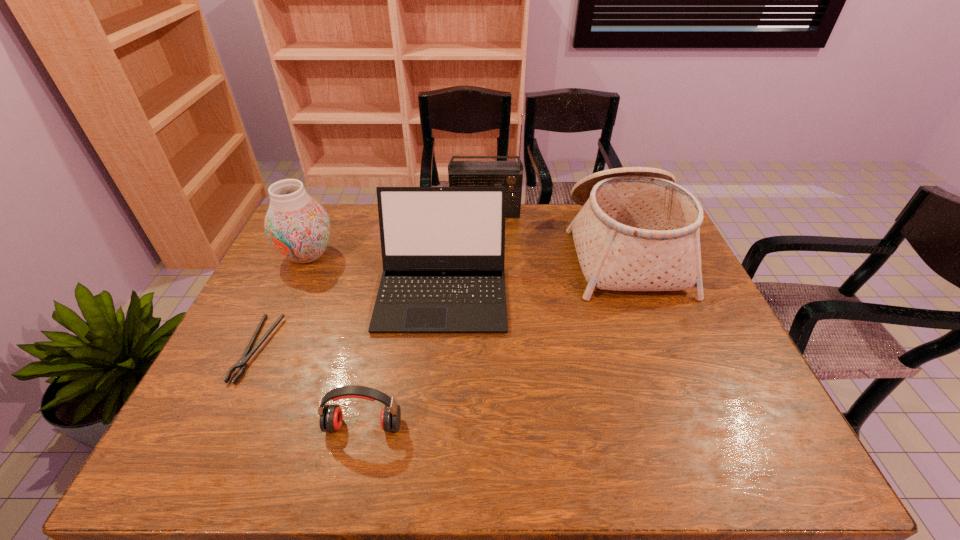
Locate an element on the screen. The height and width of the screenshot is (540, 960). tongs positioned at the left edge is located at coordinates (242, 363).

Find the location of a particular element. object that is at the right edge is located at coordinates (638, 230).

In order to click on object that is at the far left corner in this screenshot , I will do `click(298, 227)`.

Where is `object that is at the far right corner`? object that is at the far right corner is located at coordinates (638, 230).

Where is `free space at the far edge`? free space at the far edge is located at coordinates (505, 220).

Locate an element on the screen. Image resolution: width=960 pixels, height=540 pixels. vacant space at the near edge of the desktop is located at coordinates (348, 450).

The image size is (960, 540). In order to click on free space at the left edge of the desktop in this screenshot , I will do `click(296, 282)`.

In the image, there is a desktop. What are the coordinates of `vacant space at the far left corner` in the screenshot? It's located at (333, 207).

What are the coordinates of `free space between the earphone and the vase` in the screenshot? It's located at (336, 340).

You are a GUI agent. You are given a task and a screenshot of the screen. Output one action in this format:
    pyautogui.click(x=<x>, y=<y>)
    Task: Click on the unoccupied position between the vase and the second shortest object
    The height and width of the screenshot is (540, 960).
    Given the screenshot: What is the action you would take?
    pyautogui.click(x=336, y=340)